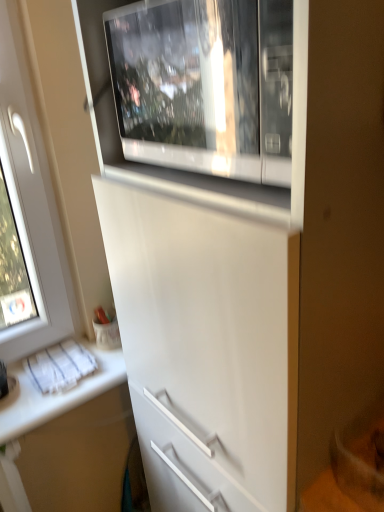
Question: From a real-world perspective, relative to white glossy microwave at upper center, is white glossy countertop at lower left vertically above or below?

Choices:
 (A) below
 (B) above

Answer: (A)

Question: In terms of width, does white glossy countertop at lower left look wider or thinner when compared to white glossy microwave at upper center?

Choices:
 (A) thin
 (B) wide

Answer: (B)

Question: Choose the correct answer: Is white glossy countertop at lower left inside white glossy microwave at upper center or outside it?

Choices:
 (A) inside
 (B) outside

Answer: (B)

Question: Based on their positions, is white glossy microwave at upper center located to the left or right of white glossy countertop at lower left?

Choices:
 (A) right
 (B) left

Answer: (A)

Question: Choose the correct answer: Is white glossy microwave at upper center inside white glossy countertop at lower left or outside it?

Choices:
 (A) inside
 (B) outside

Answer: (B)

Question: From the image's perspective, is white glossy microwave at upper center above or below white glossy countertop at lower left?

Choices:
 (A) above
 (B) below

Answer: (A)

Question: From their relative heights in the image, would you say white glossy microwave at upper center is taller or shorter than white glossy countertop at lower left?

Choices:
 (A) short
 (B) tall

Answer: (B)